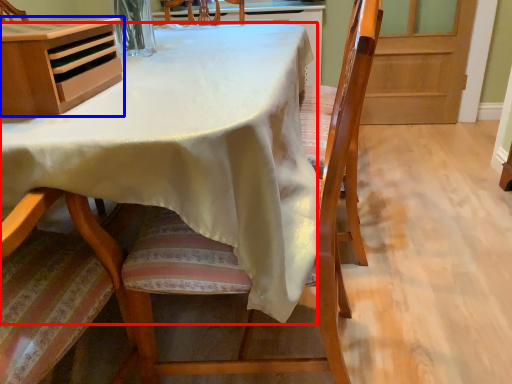
Question: Which object appears closest to the camera in this image, table (highlighted by a red box) or cabinetry (highlighted by a blue box)?

Choices:
 (A) table
 (B) cabinetry

Answer: (A)